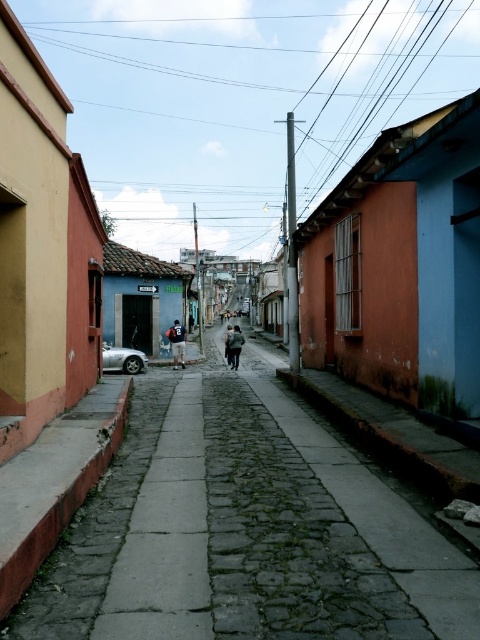
You are a delivery person trying to park your silver metallic car at left in the gray cobblestone pavement at center. Can you fit your car there?

The gray cobblestone pavement at center might be wider than silver metallic car at left, so it is possible that the car can fit there, but there is uncertainty due to the word might in the description.

What is the 2D coordinate of the gray cobblestone pavement at center?

The gray cobblestone pavement at center is located at the 2D coordinate point of (245, 531).

From the picture: You are standing on the gray cobblestone pavement at center and want to reach the silver metallic car at left. Which direction should you move to get closer to the car?

Since the gray cobblestone pavement at center is closer to the viewer than the silver metallic car at left, you should move backward to get closer to the silver metallic car at left.